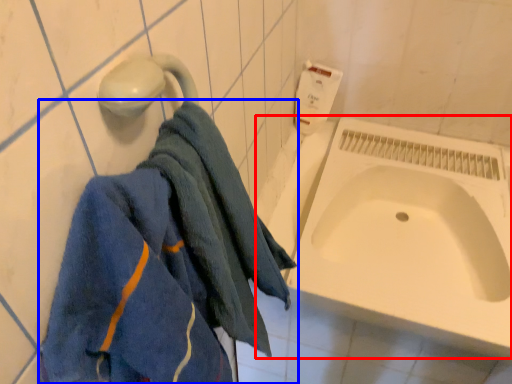
Question: Among these objects, which one is farthest to the camera, bath (highlighted by a red box) or towel (highlighted by a blue box)?

Choices:
 (A) bath
 (B) towel

Answer: (A)